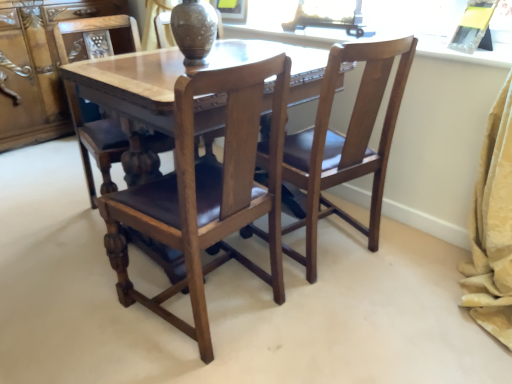
In order to click on vacant space underneath polished wood chair at center, the 2th chair when ordered from right to left (from a real-world perspective) in this screenshot , I will do `click(217, 307)`.